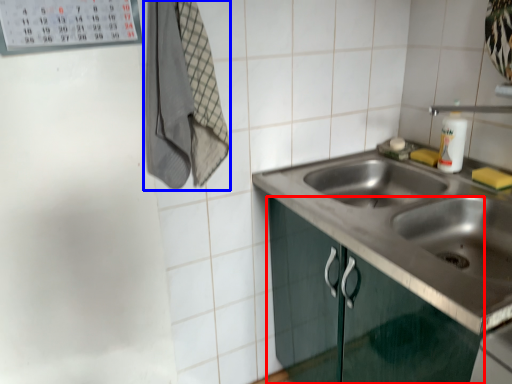
Question: Which of the following is the closest to the observer, cabinetry (highlighted by a red box) or laundry (highlighted by a blue box)?

Choices:
 (A) cabinetry
 (B) laundry

Answer: (A)